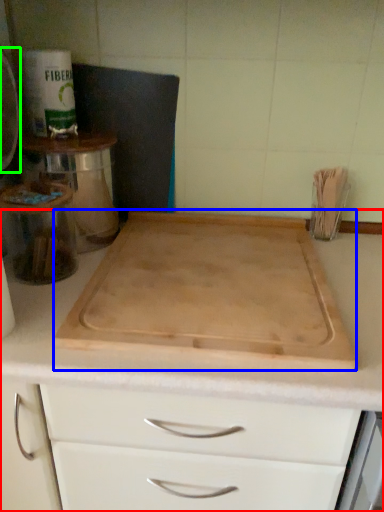
Question: Considering the real-world distances, which object is closest to countertop (highlighted by a red box)? cutting board (highlighted by a blue box) or appliance (highlighted by a green box).

Choices:
 (A) cutting board
 (B) appliance

Answer: (A)